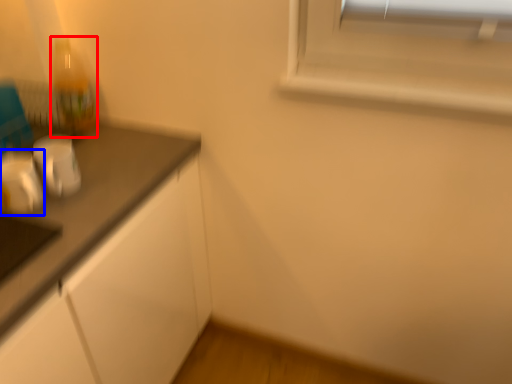
Question: Which point is closer to the camera, bottle (highlighted by a red box) or appliance (highlighted by a blue box)?

Choices:
 (A) bottle
 (B) appliance

Answer: (B)